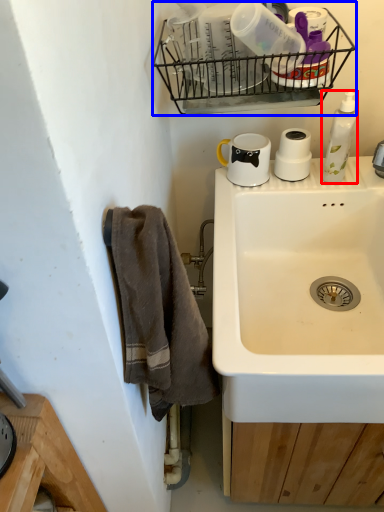
Question: Which point is further to the camera, cleaning product (highlighted by a red box) or basket (highlighted by a blue box)?

Choices:
 (A) cleaning product
 (B) basket

Answer: (A)